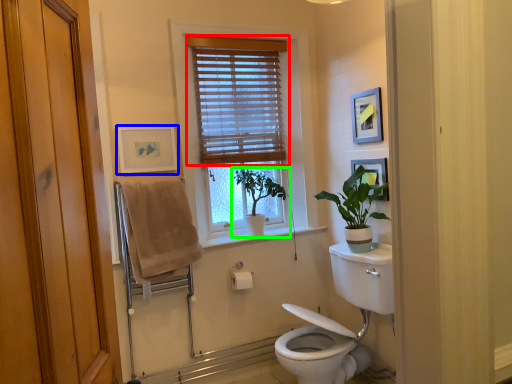
Question: Which object is the farthest from window blind (highlighted by a red box)? Choose among these: picture frame (highlighted by a blue box) or houseplant (highlighted by a green box).

Choices:
 (A) picture frame
 (B) houseplant

Answer: (A)